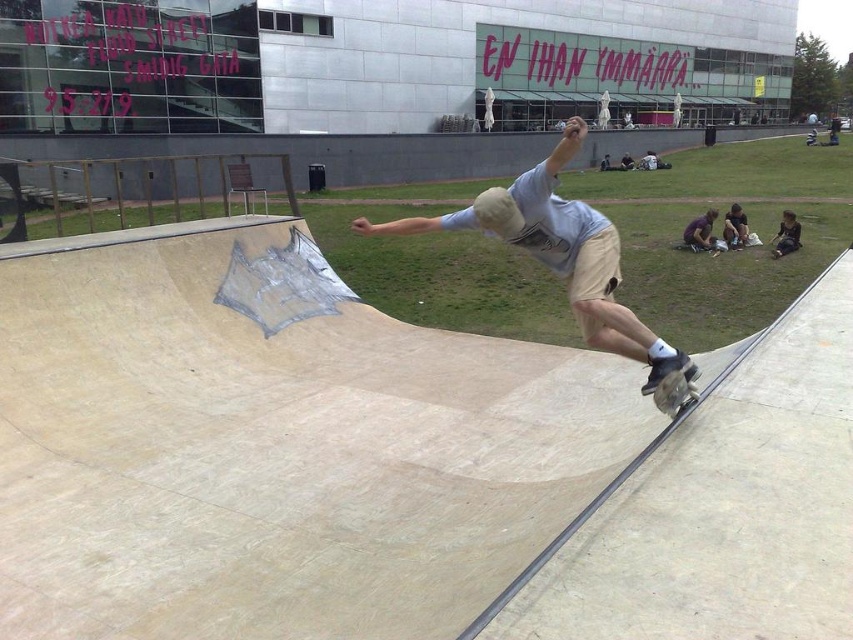
You are a photographer trying to capture the skateboarder midair. You notice the light beige shorts at center and the wooden textured skateboard at lower right. Which object is wider in the image?

The light beige shorts at center might be wider than wooden textured skateboard at lower right according to the description.

You are at the skatepark and want to place a sticker on the ramp. You have two points to choose from, point (688,385) and point (782,234). Which point is closer to you if you are standing in front of the ramp?

Point (688,385) is closer to the camera than point (782,234), so the sticker placed there would be closer to you.

You are a photographer at the skatepark and want to capture a photo of the light beige shorts at center and dark blue jeans at lower right in the same frame. Based on their positions, which clothing item will appear larger in the photo?

The light beige shorts at center will appear larger in the photo because it is taller than the dark blue jeans at lower right.